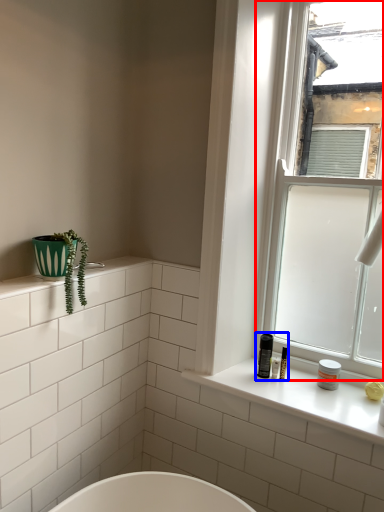
Question: Which of the following is the farthest to the observer, window (highlighted by a red box) or toiletry (highlighted by a blue box)?

Choices:
 (A) window
 (B) toiletry

Answer: (B)